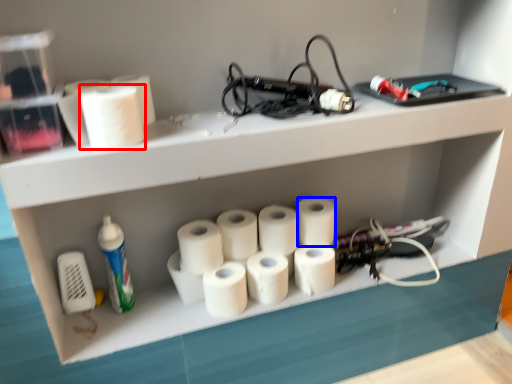
Question: Among these objects, which one is nearest to the camera, paper towel (highlighted by a red box) or paper towel (highlighted by a blue box)?

Choices:
 (A) paper towel
 (B) paper towel

Answer: (A)